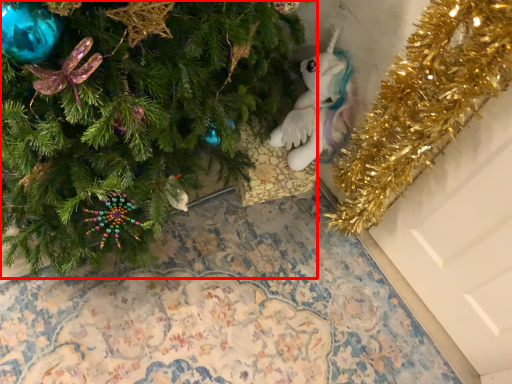
Question: Considering the relative positions of christmas tree (annotated by the red box) and toy in the image provided, where is christmas tree (annotated by the red box) located with respect to the staircase?

Choices:
 (A) right
 (B) left

Answer: (B)